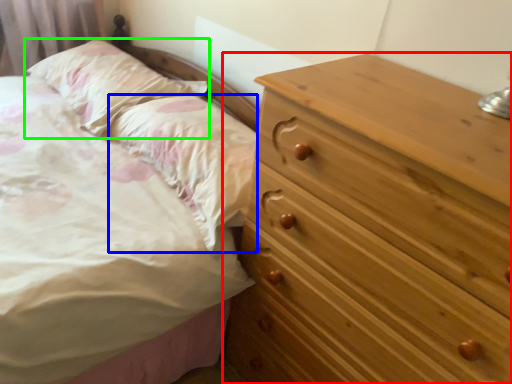
Question: Which object is positioned farthest from chest of drawers (highlighted by a red box)? Select from pillow (highlighted by a blue box) and pillow (highlighted by a green box).

Choices:
 (A) pillow
 (B) pillow

Answer: (B)